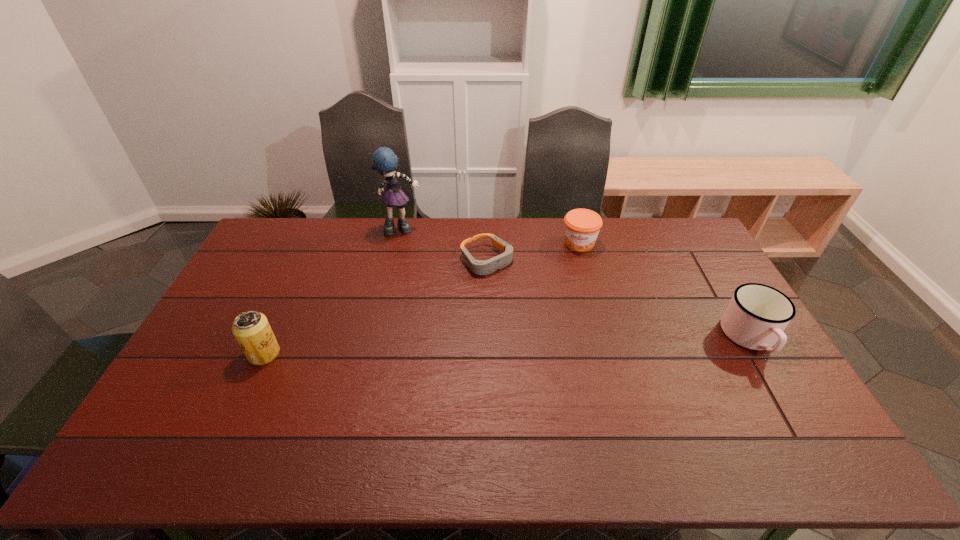
Where is `the leftmost object`? the leftmost object is located at coordinates (251, 329).

Where is `mug`? The height and width of the screenshot is (540, 960). mug is located at coordinates (757, 315).

Where is `the third object from left to right`? The width and height of the screenshot is (960, 540). the third object from left to right is located at coordinates (479, 267).

The width and height of the screenshot is (960, 540). What are the coordinates of `the shortest object` in the screenshot? It's located at (479, 267).

The image size is (960, 540). I want to click on the tallest object, so click(384, 160).

This screenshot has height=540, width=960. Identify the location of rag doll. (384, 160).

Where is `jam`? The height and width of the screenshot is (540, 960). jam is located at coordinates (582, 226).

Where is `the fourth object from left to right`? The width and height of the screenshot is (960, 540). the fourth object from left to right is located at coordinates (582, 226).

Where is `free space located 0.340m on the right of the beer can`? This screenshot has width=960, height=540. free space located 0.340m on the right of the beer can is located at coordinates (397, 354).

Where is `free region located on the side of the mug with the handle`? The height and width of the screenshot is (540, 960). free region located on the side of the mug with the handle is located at coordinates (783, 394).